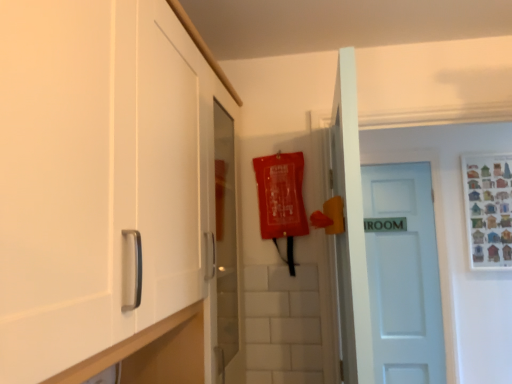
The image size is (512, 384). Find the location of `white matte cabinet at left`. white matte cabinet at left is located at coordinates (98, 174).

What do you see at coordinates (98, 174) in the screenshot? I see `white matte cabinet at left` at bounding box center [98, 174].

What do you see at coordinates (403, 273) in the screenshot? The height and width of the screenshot is (384, 512). I see `white matte door at center` at bounding box center [403, 273].

Where is `white matte door at center`? white matte door at center is located at coordinates (403, 273).

This screenshot has height=384, width=512. I want to click on white matte cabinet at left, so click(x=98, y=174).

Based on the photo, does white matte cabinet at left appear on the left side of white matte door at center?

Correct, you'll find white matte cabinet at left to the left of white matte door at center.

Is white matte cabinet at left in front of white matte door at center?

Yes, white matte cabinet at left is closer to the viewer.

Is point (142, 47) more distant than point (437, 274)?

No.

Looking at this image, from the image's perspective, is white matte cabinet at left located beneath white matte door at center?

Actually, white matte cabinet at left appears above white matte door at center in the image.

From the picture: From a real-world perspective, is white matte cabinet at left below white matte door at center?

No, from a real-world perspective, white matte cabinet at left is not below white matte door at center.

Does white matte cabinet at left have a lesser width compared to white matte door at center?

Answer: Incorrect, the width of white matte cabinet at left is not less than that of white matte door at center.

Considering the sizes of objects white matte cabinet at left and white matte door at center in the image provided, who is shorter, white matte cabinet at left or white matte door at center?

white matte cabinet at left.

Looking at the image, does white matte cabinet at left seem bigger or smaller compared to white matte door at center?

In the image, white matte cabinet at left appears to be larger than white matte door at center.

Is white matte door at center a part of white matte cabinet at left?

No, white matte door at center is not a part of white matte cabinet at left.

From the picture: Is white matte cabinet at left positioned far away from white matte door at center?

white matte cabinet at left is positioned a significant distance from white matte door at center.

Is white matte cabinet at left aimed at white matte door at center?

No.

How much distance is there between white matte cabinet at left and white matte door at center?

2.01 meters.

Image resolution: width=512 pixels, height=384 pixels. In order to click on cabinetry in front of the white matte door at center in this screenshot , I will do `click(98, 174)`.

Visually, is white matte door at center positioned to the left or to the right of white matte cabinet at left?

white matte door at center is positioned on white matte cabinet at left's right side.

From the picture: Is white matte door at center positioned behind white matte cabinet at left?

Yes.

Is point (385, 276) closer or farther from the camera than point (65, 8)?

Point (385, 276) appears to be farther away from the viewer than point (65, 8).

From the image's perspective, is white matte door at center located above or below white matte cabinet at left?

white matte door at center is below white matte cabinet at left.

From a real-world perspective, which is physically above, white matte door at center or white matte cabinet at left?

white matte cabinet at left, from a real-world perspective.

Can you confirm if white matte door at center is wider than white matte cabinet at left?

In fact, white matte door at center might be narrower than white matte cabinet at left.

Between white matte door at center and white matte cabinet at left, which one has less height?

white matte cabinet at left.

Looking at the image, does white matte door at center seem bigger or smaller compared to white matte cabinet at left?

In the image, white matte door at center appears to be smaller than white matte cabinet at left.

Choose the correct answer: Is white matte door at center inside white matte cabinet at left or outside it?

white matte door at center lies outside white matte cabinet at left.

Is white matte door at center with white matte cabinet at left?

white matte door at center and white matte cabinet at left are not in contact.

Is white matte door at center positioned with its back to white matte cabinet at left?

white matte door at center is not turned away from white matte cabinet at left.

Where is `cabinetry that is in front of the white matte door at center`? The image size is (512, 384). cabinetry that is in front of the white matte door at center is located at coordinates (98, 174).

Locate an element on the screen. The width and height of the screenshot is (512, 384). door that appears behind the white matte cabinet at left is located at coordinates [403, 273].

What are the coordinates of `cabinetry located above the white matte door at center (from a real-world perspective)` in the screenshot? It's located at (98, 174).